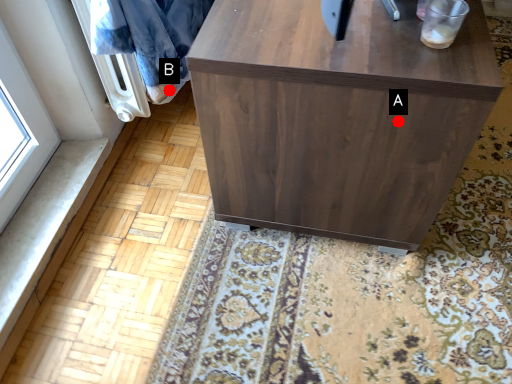
Question: Two points are circled on the image, labeled by A and B beside each circle. Which point appears closest to the camera in this image?

Choices:
 (A) A is closer
 (B) B is closer

Answer: (A)